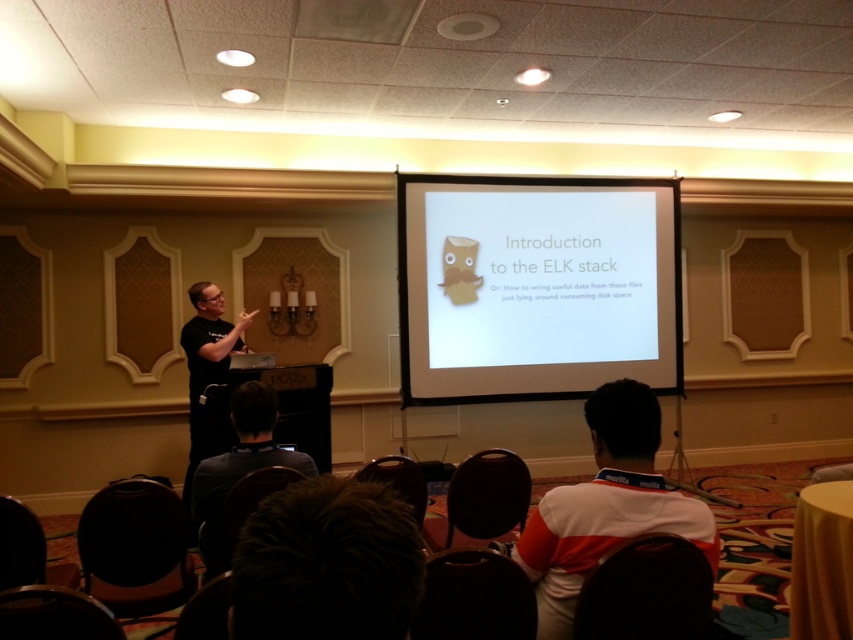
Is white striped shirt at lower center further to camera compared to black matte shirt at left?

That is False.

Does white striped shirt at lower center lie in front of black matte shirt at left?

Yes.

Between point (612, 486) and point (196, 403), which one is positioned in front?

Point (612, 486)

Find the location of a particular element. The width and height of the screenshot is (853, 640). white striped shirt at lower center is located at coordinates (606, 506).

Is the position of white striped shirt at lower center more distant than that of dark gray shirt at lower center?

No.

Does white striped shirt at lower center appear on the right side of dark gray shirt at lower center?

Correct, you'll find white striped shirt at lower center to the right of dark gray shirt at lower center.

Does point (641, 477) lie behind point (254, 422)?

No, it is not.

I want to click on white striped shirt at lower center, so click(606, 506).

Which is above, white matte projector screen at center or black matte shirt at left?

Positioned higher is white matte projector screen at center.

Is white matte projector screen at center to the left of black matte shirt at left from the viewer's perspective?

No, white matte projector screen at center is not to the left of black matte shirt at left.

Is point (459, 288) farther from camera compared to point (202, 452)?

Yes, it is.

Find the location of a particular element. white matte projector screen at center is located at coordinates (535, 285).